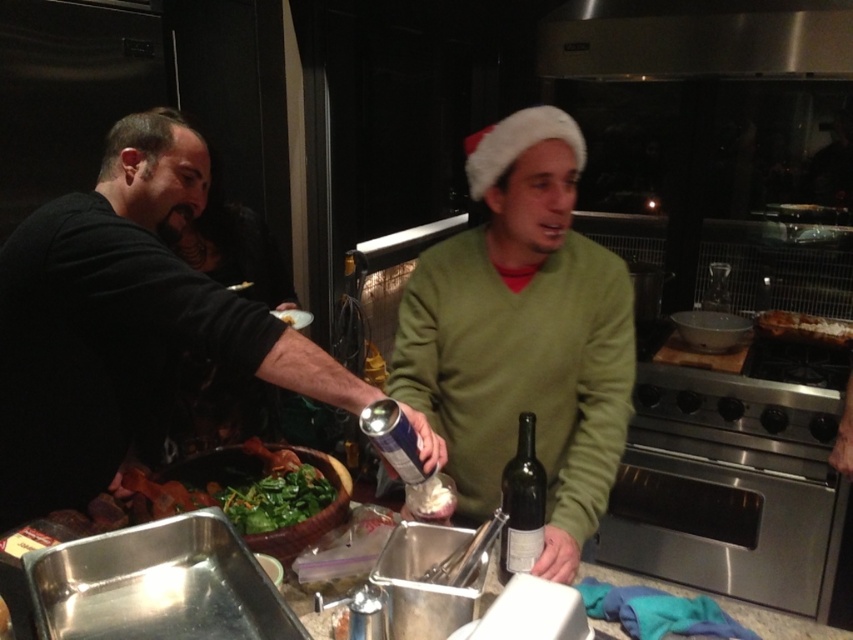
Question: Does black matte shirt at left appear over stainless steel exhaust hood at upper center?

Choices:
 (A) no
 (B) yes

Answer: (A)

Question: Which point appears farthest from the camera in this image?

Choices:
 (A) (654, 376)
 (B) (148, 412)
 (C) (393, 429)

Answer: (A)

Question: Is green matte sweater at center thinner than black matte wine bottle at lower center?

Choices:
 (A) no
 (B) yes

Answer: (A)

Question: Is black matte shirt at left smaller than matte glass bottle at center?

Choices:
 (A) yes
 (B) no

Answer: (B)

Question: Which object is farther from the camera taking this photo?

Choices:
 (A) stainless steel oven at lower right
 (B) green leafy vegetables at center

Answer: (A)

Question: Which point appears closest to the camera in this image?

Choices:
 (A) (596, 269)
 (B) (828, 340)
 (C) (306, 513)
 (D) (22, 314)

Answer: (D)